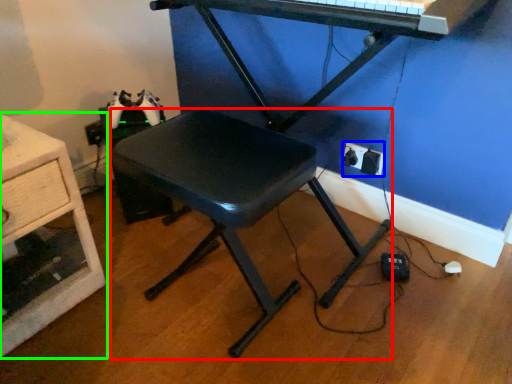
Question: Considering the real-world distances, which object is farthest from stool (highlighted by a red box)? electric outlet (highlighted by a blue box) or furniture (highlighted by a green box)?

Choices:
 (A) electric outlet
 (B) furniture

Answer: (A)